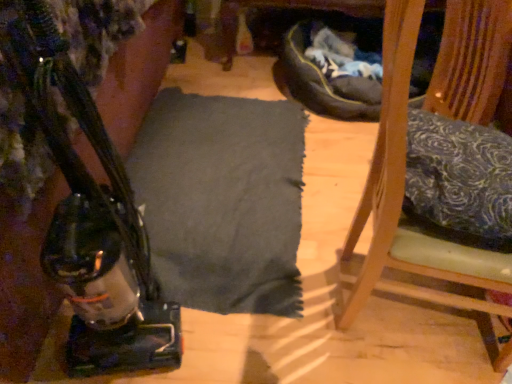
The image size is (512, 384). What are the coordinates of `free point to the left of wooden chair at right` in the screenshot? It's located at (288, 315).